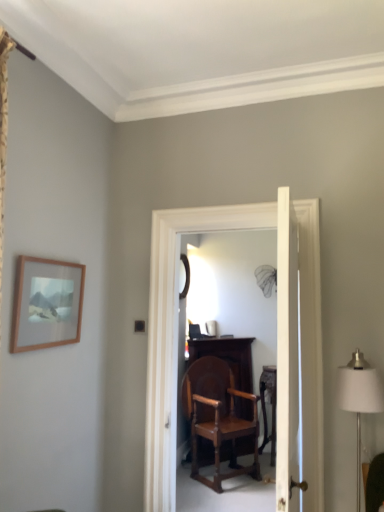
Question: Is white smooth door at center facing towards wooden chair at center?

Choices:
 (A) yes
 (B) no

Answer: (B)

Question: Is white smooth door at center to the right of wooden chair at center from the viewer's perspective?

Choices:
 (A) yes
 (B) no

Answer: (A)

Question: Considering the relative positions of white smooth door at center and wooden chair at center in the image provided, is white smooth door at center to the left of wooden chair at center from the viewer's perspective?

Choices:
 (A) yes
 (B) no

Answer: (B)

Question: Is white smooth door at center positioned before wooden chair at center?

Choices:
 (A) yes
 (B) no

Answer: (A)

Question: From the image's perspective, is white smooth door at center located beneath wooden chair at center?

Choices:
 (A) no
 (B) yes

Answer: (A)

Question: Is white smooth door at center not within wooden chair at center?

Choices:
 (A) yes
 (B) no

Answer: (A)

Question: Could you tell me if white smooth door at center is facing black glass mirror at center?

Choices:
 (A) no
 (B) yes

Answer: (A)

Question: Is white smooth door at center bigger than black glass mirror at center?

Choices:
 (A) no
 (B) yes

Answer: (B)

Question: From a real-world perspective, is white smooth door at center under black glass mirror at center?

Choices:
 (A) yes
 (B) no

Answer: (A)

Question: Is white smooth door at center taller than black glass mirror at center?

Choices:
 (A) no
 (B) yes

Answer: (B)

Question: Is white smooth door at center looking in the opposite direction of black glass mirror at center?

Choices:
 (A) no
 (B) yes

Answer: (A)

Question: Considering the relative positions of white smooth door at center and black glass mirror at center in the image provided, is white smooth door at center to the left of black glass mirror at center from the viewer's perspective?

Choices:
 (A) yes
 (B) no

Answer: (B)

Question: Does white smooth door at center touch wooden table at center?

Choices:
 (A) no
 (B) yes

Answer: (A)